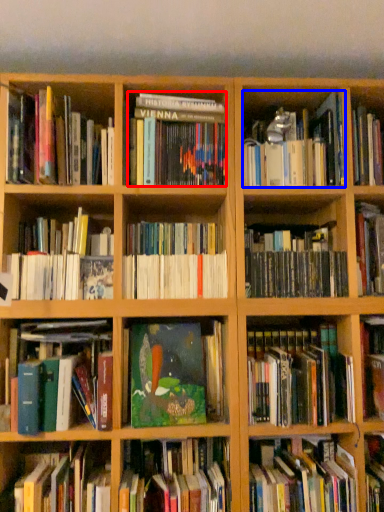
Question: Which point is further to the camera, book (highlighted by a red box) or book (highlighted by a blue box)?

Choices:
 (A) book
 (B) book

Answer: (A)